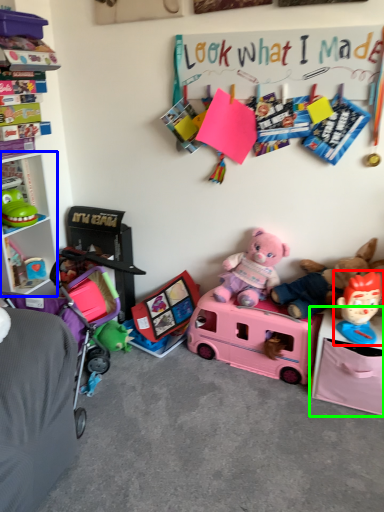
Question: Considering the real-world distances, which object is closest to toy (highlighted by a red box)? cabinet (highlighted by a blue box) or changing table (highlighted by a green box).

Choices:
 (A) cabinet
 (B) changing table

Answer: (B)